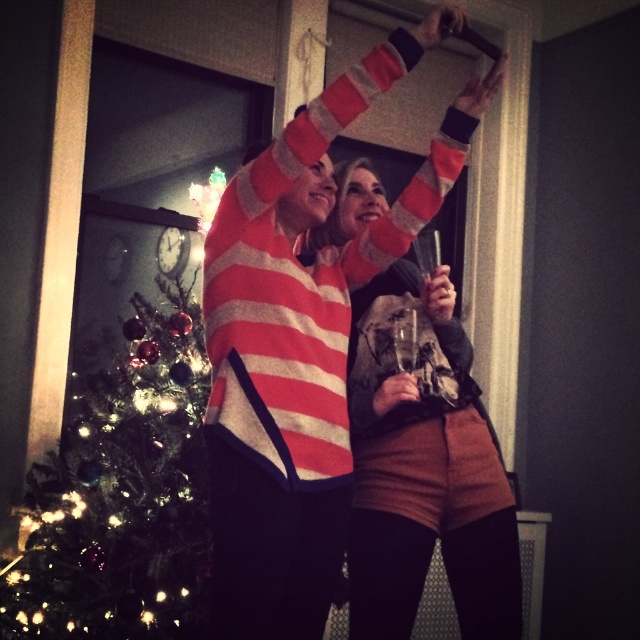
Does green textured christmas tree at left have a larger size compared to striped sweater at center?

Yes.

Is green textured christmas tree at left smaller than striped sweater at center?

A: Incorrect, green textured christmas tree at left is not smaller in size than striped sweater at center.

The image size is (640, 640). In order to click on green textured christmas tree at left in this screenshot , I will do `click(122, 496)`.